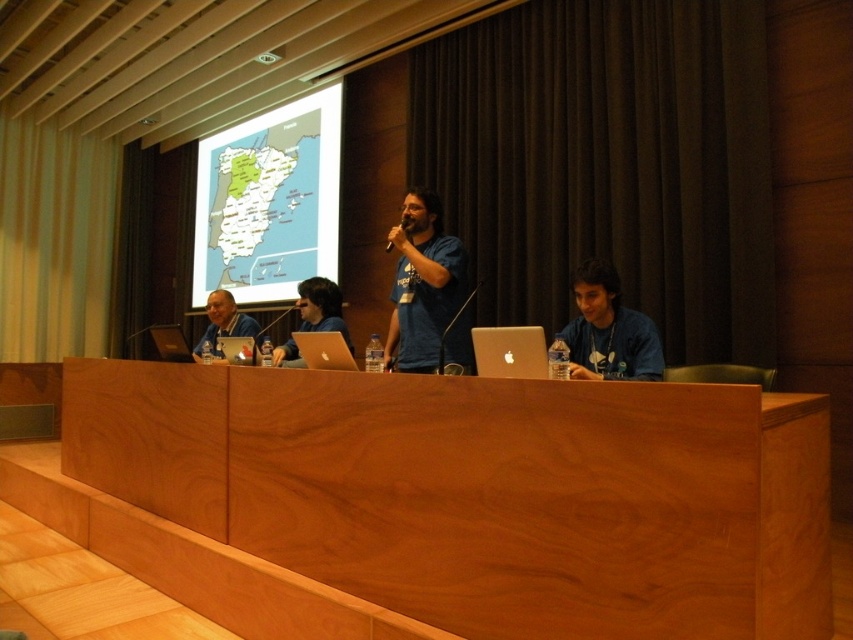
Question: Can you confirm if blue cotton shirt at center is wider than metallic silver laptop at center?

Choices:
 (A) yes
 (B) no

Answer: (A)

Question: Is matte map at upper center behind blue cotton shirt at center?

Choices:
 (A) yes
 (B) no

Answer: (A)

Question: Which object appears closest to the camera in this image?

Choices:
 (A) green fabric curtain at upper left
 (B) metallic silver laptop at center

Answer: (B)

Question: Which point is closer to the camera taking this photo?

Choices:
 (A) (596, 333)
 (B) (393, 291)

Answer: (A)

Question: Which point appears closest to the camera in this image?

Choices:
 (A) (233, 358)
 (B) (86, 192)
 (C) (521, 330)
 (D) (318, 278)

Answer: (C)

Question: Does blue fabric shirt at lower right appear on the left side of silver metallic laptop at center?

Choices:
 (A) yes
 (B) no

Answer: (B)